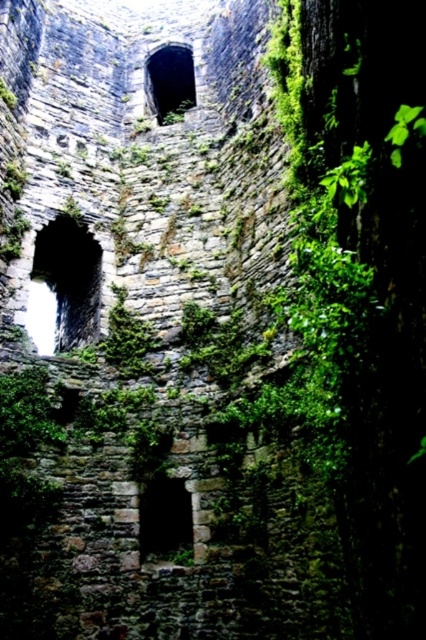
Question: Estimate the real-world distances between objects in this image. Which object is farther from the green mossy stone window at upper center?

Choices:
 (A) dark stone window at left
 (B) dark stone window at center

Answer: (B)

Question: Is dark stone window at left positioned at the back of green mossy stone window at upper center?

Choices:
 (A) no
 (B) yes

Answer: (A)

Question: Estimate the real-world distances between objects in this image. Which object is closer to the green mossy stone window at upper center?

Choices:
 (A) dark stone window at left
 (B) dark stone window at center

Answer: (A)

Question: Does dark stone window at center have a greater width compared to green mossy stone window at upper center?

Choices:
 (A) yes
 (B) no

Answer: (B)

Question: In this image, where is dark stone window at left located relative to dark stone window at center?

Choices:
 (A) above
 (B) below

Answer: (A)

Question: Which object appears farthest from the camera in this image?

Choices:
 (A) dark stone window at left
 (B) dark stone window at center

Answer: (A)